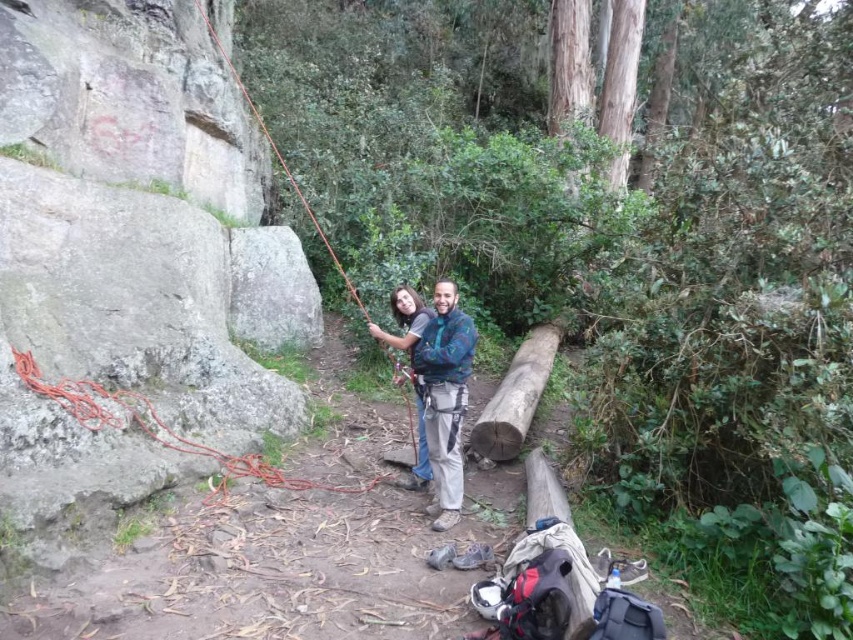
You are planning to use the orange rope at left to secure the blue patterned shirt at center during a climbing activity. Based on their thickness, which one is more suitable for tying a secure knot?

The orange rope at left is thicker than the blue patterned shirt at center, making it more suitable for tying a secure knot because thicker ropes generally provide better strength and stability for knots.

Based on the coordinates provided, which object is located at point (158, 426)?

The orange rope at left is located at point (158, 426).